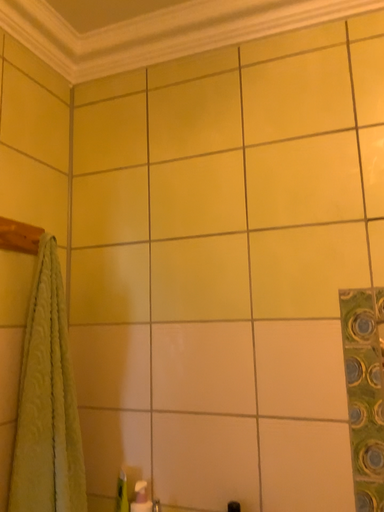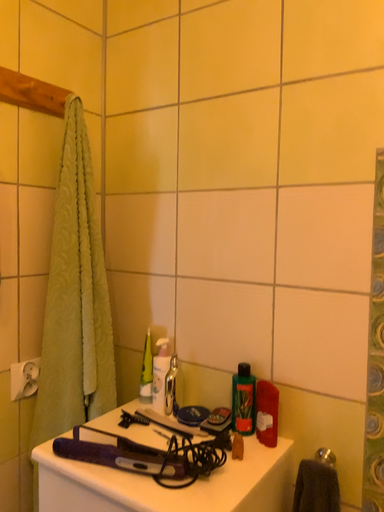
Question: Which way did the camera rotate in the video?

Choices:
 (A) rotated upward
 (B) rotated downward

Answer: (B)